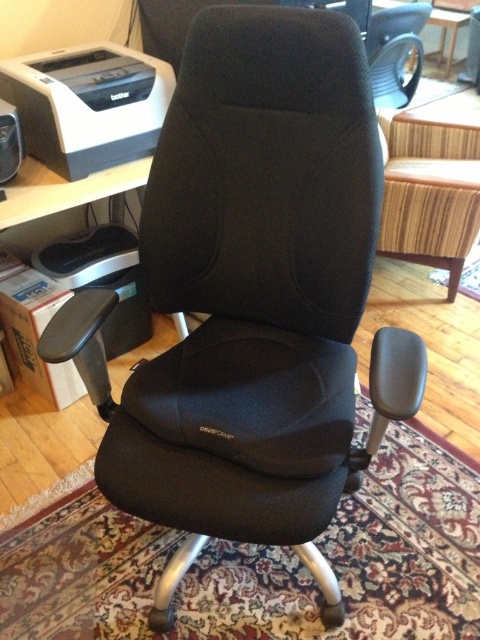
Question: Which of the following is the farthest from the observer?

Choices:
 (A) (82, 86)
 (B) (15, 138)

Answer: (A)

Question: In this image, where is matte black printer at upper left located relative to black matte speaker at upper left?

Choices:
 (A) below
 (B) above

Answer: (B)

Question: Which object appears farthest from the camera in this image?

Choices:
 (A) black matte speaker at upper left
 (B) matte black printer at upper left

Answer: (B)

Question: Is matte black printer at upper left positioned in front of black matte speaker at upper left?

Choices:
 (A) no
 (B) yes

Answer: (A)

Question: Can you confirm if matte black printer at upper left is wider than black matte speaker at upper left?

Choices:
 (A) yes
 (B) no

Answer: (A)